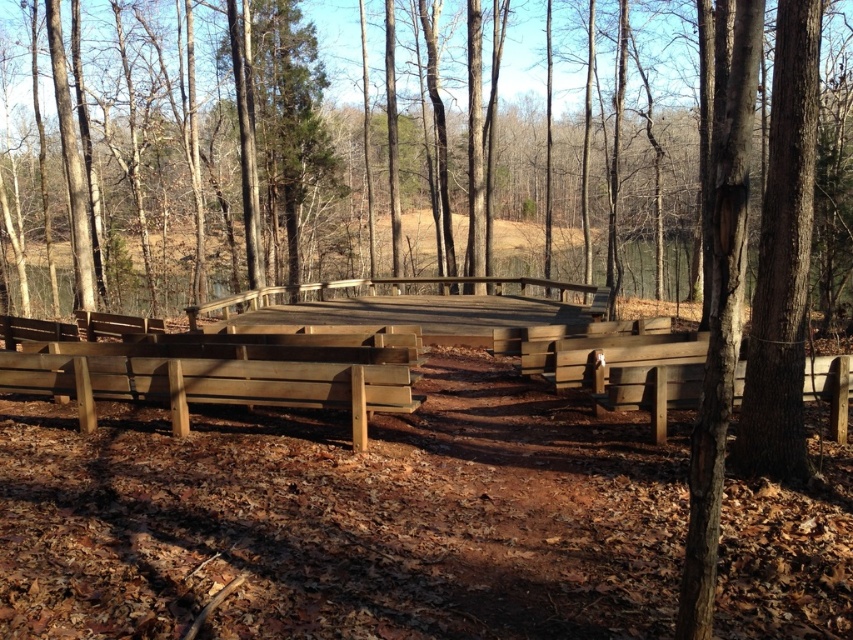
Is wooden bench at lower center to the left of wooden bench at right from the viewer's perspective?

Yes, wooden bench at lower center is to the left of wooden bench at right.

The width and height of the screenshot is (853, 640). Find the location of `wooden bench at lower center`. wooden bench at lower center is located at coordinates (210, 385).

Is point (194, 397) more distant than point (822, 358)?

That is True.

Identify the location of wooden bench at lower center. (210, 385).